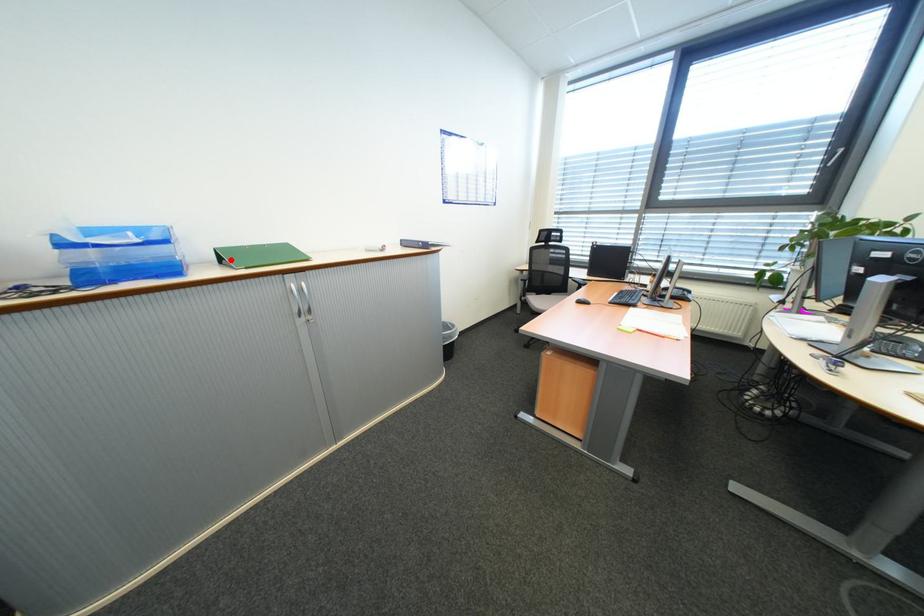
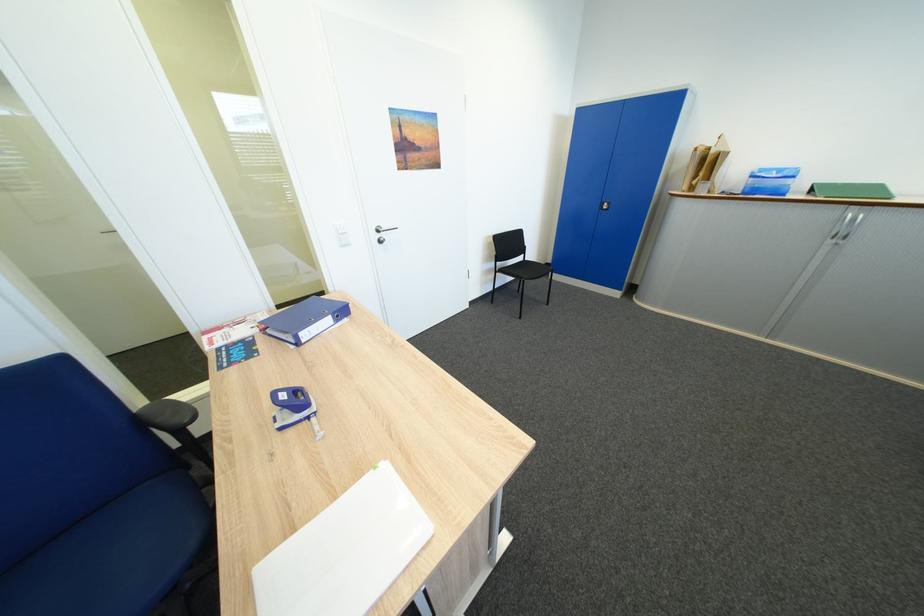
The point at the highlighted location is marked in the first image. Where is the corresponding point in the second image?

(822, 192)